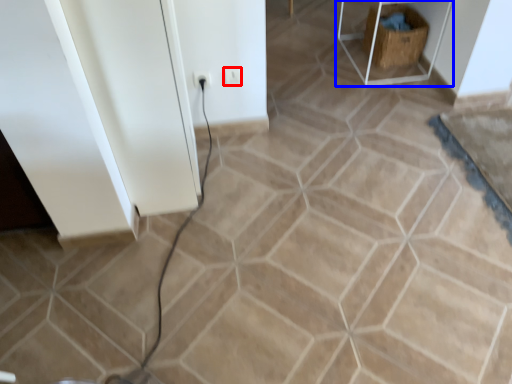
Question: Among these objects, which one is nearest to the camera, electric outlet (highlighted by a red box) or furniture (highlighted by a blue box)?

Choices:
 (A) electric outlet
 (B) furniture

Answer: (A)